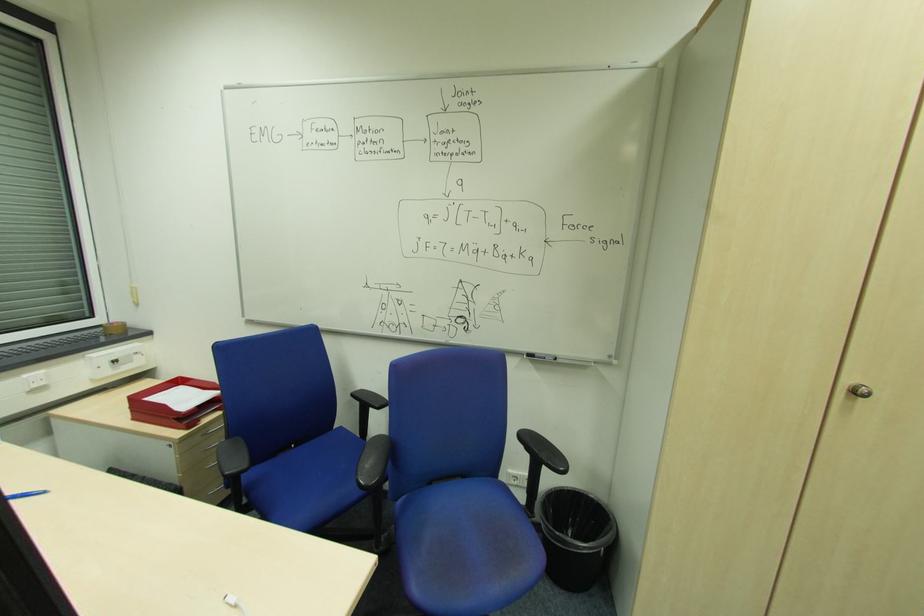
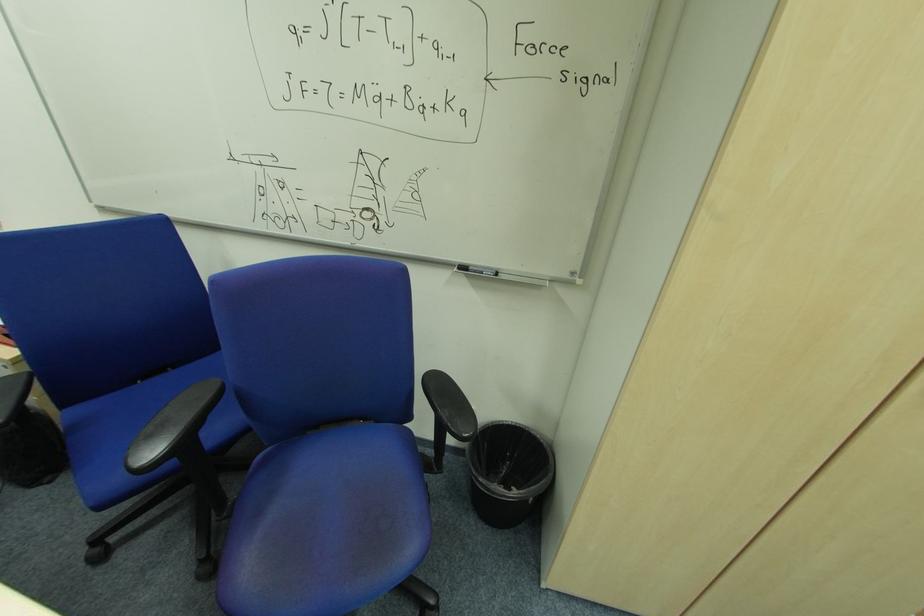
Question: The images are taken continuously from a first-person perspective. In which direction is your viewpoint rotating?

Choices:
 (A) Left
 (B) Right
 (C) Up
 (D) Down

Answer: (D)